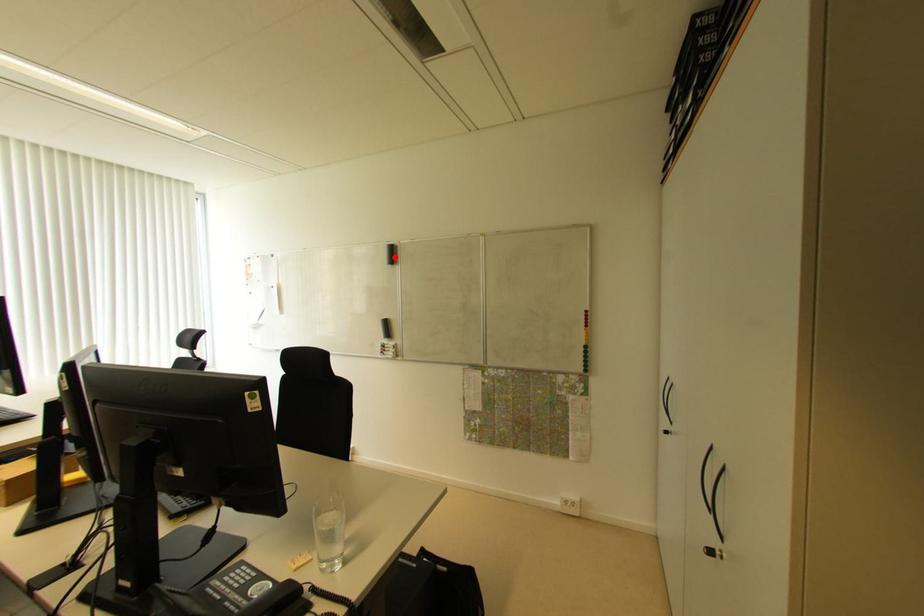
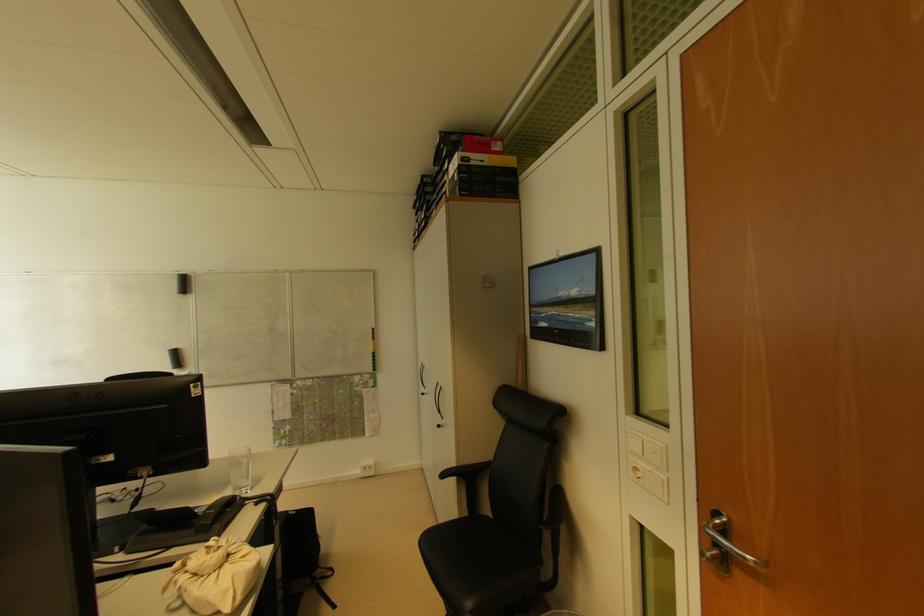
Locate, in the second image, the point that corresponds to the highlighted location in the first image.

(187, 286)